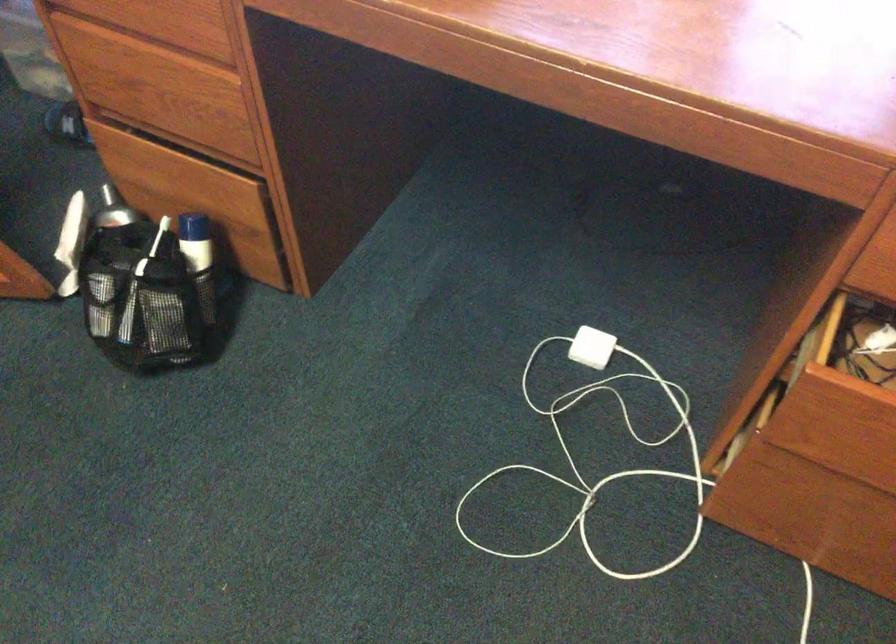
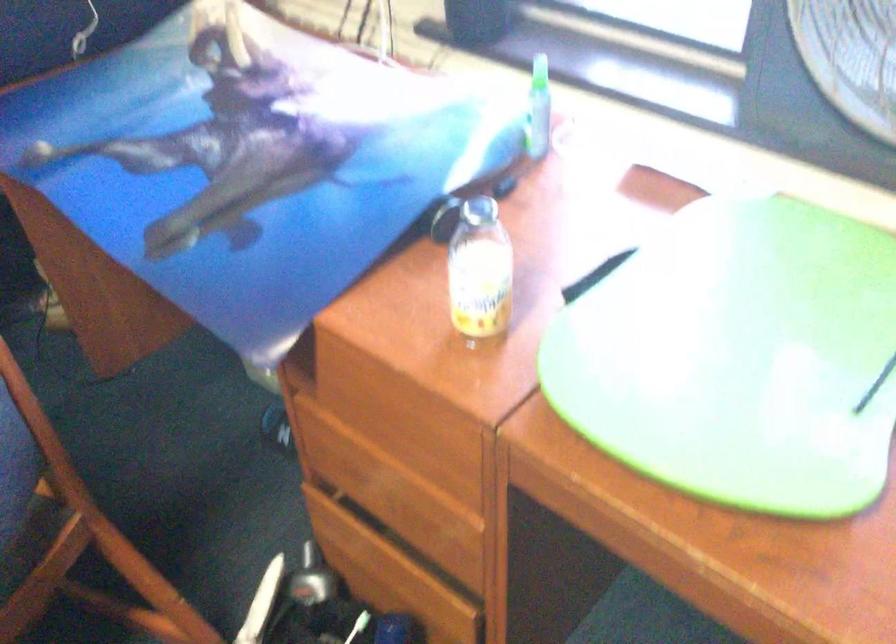
Locate, in the second image, the point that corresponds to pixel 115 216 in the first image.

(311, 579)